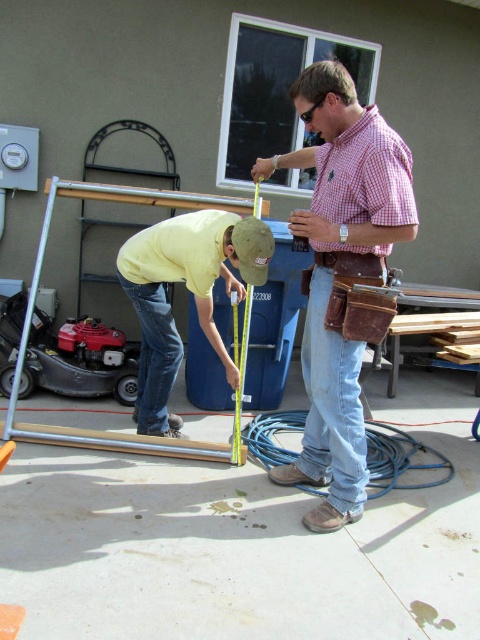
Question: Which of the following is the farthest from the observer?

Choices:
 (A) yellow cotton shirt at lower left
 (B) checkered fabric shirt at center

Answer: (A)

Question: Is checkered fabric shirt at center to the right of yellow cotton shirt at lower left from the viewer's perspective?

Choices:
 (A) yes
 (B) no

Answer: (A)

Question: Which object is farther from the camera taking this photo?

Choices:
 (A) yellow cotton shirt at lower left
 (B) checkered fabric shirt at center

Answer: (A)

Question: Among these objects, which one is nearest to the camera?

Choices:
 (A) yellow cotton shirt at lower left
 (B) checkered fabric shirt at center

Answer: (B)

Question: Is checkered fabric shirt at center to the right of yellow cotton shirt at lower left from the viewer's perspective?

Choices:
 (A) no
 (B) yes

Answer: (B)

Question: Does checkered fabric shirt at center come in front of yellow cotton shirt at lower left?

Choices:
 (A) yes
 (B) no

Answer: (A)